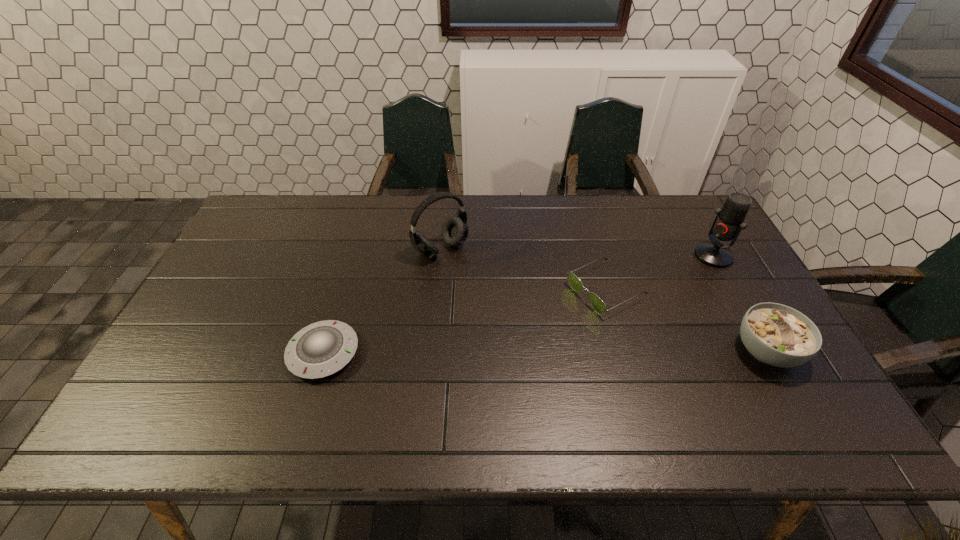
Image resolution: width=960 pixels, height=540 pixels. Find the location of `vacant space located on the front-facing side of the third object from right to left`. vacant space located on the front-facing side of the third object from right to left is located at coordinates [464, 360].

Where is `free space located on the side of the microphone with the red ring`? The image size is (960, 540). free space located on the side of the microphone with the red ring is located at coordinates (612, 313).

Where is `free spot located on the side of the microphone with the red ring`? This screenshot has height=540, width=960. free spot located on the side of the microphone with the red ring is located at coordinates (660, 286).

At what (x,y) coordinates should I click in order to perform the action: click on vacant space located on the side of the microphone with the red ring. Please return your answer as a coordinate pair (x, y). The height and width of the screenshot is (540, 960). Looking at the image, I should click on (607, 316).

Locate an element on the screen. The height and width of the screenshot is (540, 960). vacant space situated 0.200m on the ear cups of the headset is located at coordinates (496, 302).

This screenshot has height=540, width=960. I want to click on vacant position located 0.390m on the ear cups of the headset, so click(540, 347).

Identify the location of free location located on the ear cups of the headset. The height and width of the screenshot is (540, 960). [x=536, y=342].

Where is `object located in the far edge section of the desktop`? The image size is (960, 540). object located in the far edge section of the desktop is located at coordinates (455, 229).

You are a GUI agent. You are given a task and a screenshot of the screen. Output one action in this format:
    pyautogui.click(x=<x>, y=<y>)
    Task: Click on the saucer present at the near edge
    
    Given the screenshot: What is the action you would take?
    pyautogui.click(x=320, y=349)

At what (x,y) coordinates should I click in order to perform the action: click on soup bowl at the near edge. Please return your answer as a coordinate pair (x, y). Image resolution: width=960 pixels, height=540 pixels. Looking at the image, I should click on (778, 335).